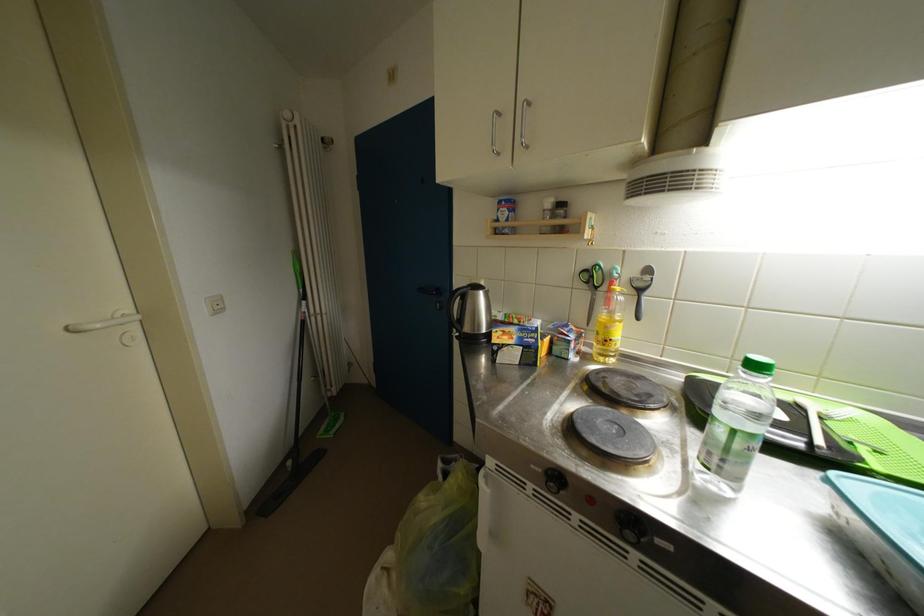
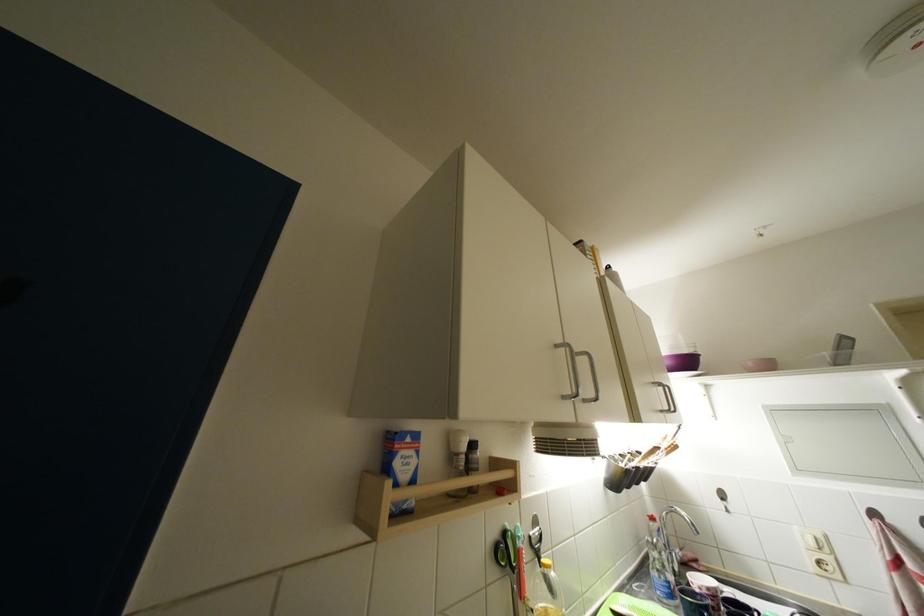
Where in the second image is the point corresponding to [505,217] from the first image?

(404, 467)